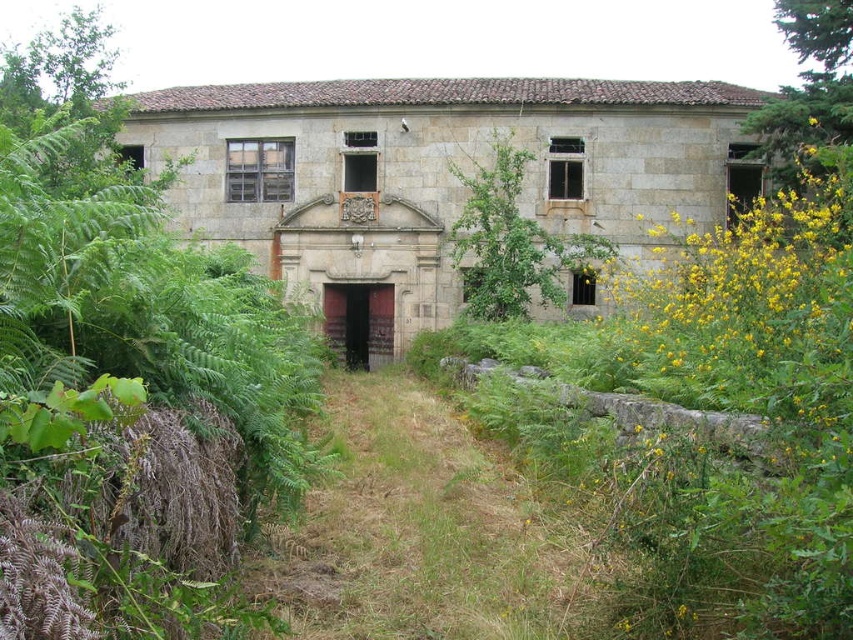
Question: Which of the following is the farthest from the observer?

Choices:
 (A) (543, 588)
 (B) (486, 320)

Answer: (B)

Question: Is green leafy plant at left further to camera compared to green grass at center?

Choices:
 (A) no
 (B) yes

Answer: (A)

Question: Does green leafy shrubs at center have a smaller size compared to green leafy plant at left?

Choices:
 (A) yes
 (B) no

Answer: (B)

Question: Which of the following is the closest to the observer?

Choices:
 (A) green leafy shrubs at center
 (B) green grass at center
 (C) green leafy plant at left

Answer: (C)

Question: Which object is closer to the camera taking this photo?

Choices:
 (A) green leafy shrubs at center
 (B) green grass at center

Answer: (A)

Question: Observing the image, what is the correct spatial positioning of green leafy shrubs at center in reference to green leafy shrub at center?

Choices:
 (A) right
 (B) left

Answer: (A)